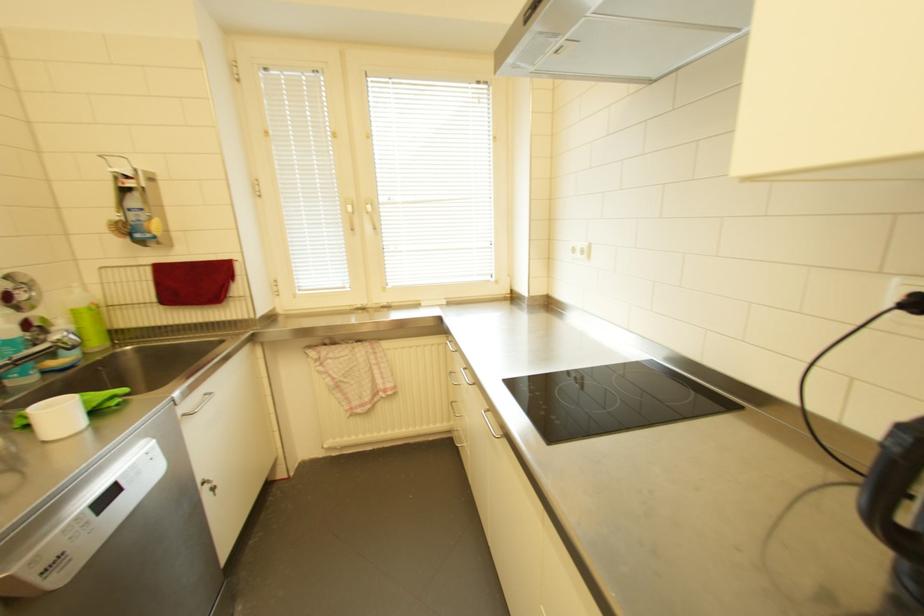
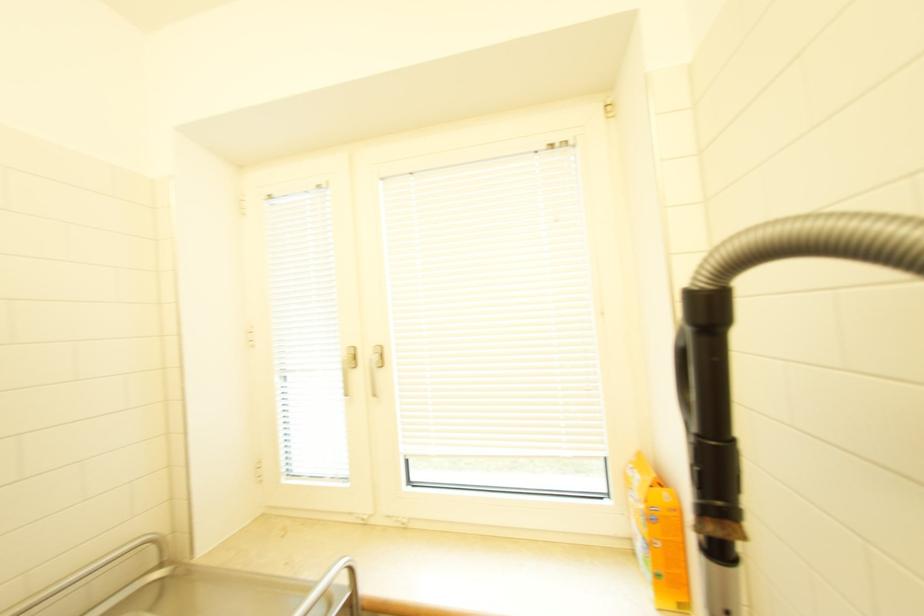
Question: Which direction would the cameraman need to move to produce the second image? Reply with the corresponding letter.

Choices:
 (A) Left
 (B) Right
 (C) Forward
 (D) Backward

Answer: (A)